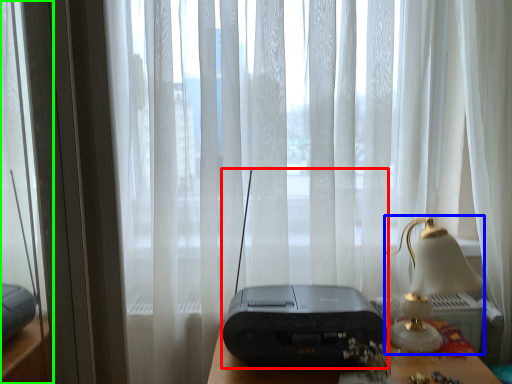
Question: Which object is positioned closest to gadget (highlighted by a red box)? Select from table lamp (highlighted by a blue box) and glass door (highlighted by a green box).

Choices:
 (A) table lamp
 (B) glass door

Answer: (A)